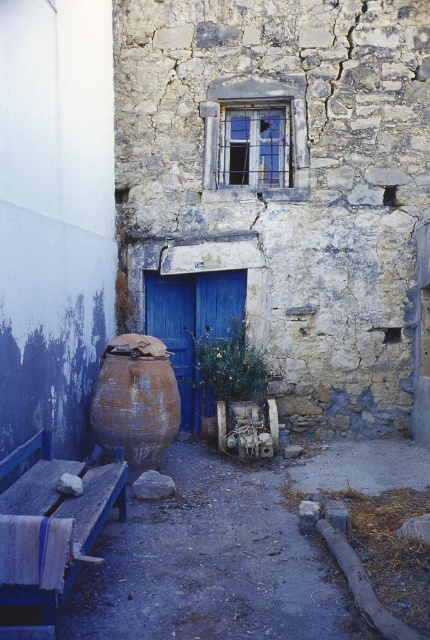
Looking at this image, you are a painter who needs to decide which object to paint first. The blue painted wood bench at lower left and the blue matte door at center are both in need of a fresh coat. Considering their sizes, which one should you tackle first if you want to start with the larger one?

The blue painted wood bench at lower left is larger in size than the blue matte door at center, so you should paint the blue painted wood bench at lower left first.

You are standing in front of the old stone building and want to take a photo. There are two points marked on the building wall at coordinates point (27, 483) and point (205, 401). Which point will appear larger in your photo?

Point (27, 483) is closer to the camera than point (205, 401). Since it is closer, it will appear larger in the photo.

You are standing in front of the old stone building and see the blue painted wood bench at lower left and the blue matte door at center. Which object is positioned lower in the scene?

The blue painted wood bench at lower left is located below the blue matte door at center, so it is positioned lower in the scene.